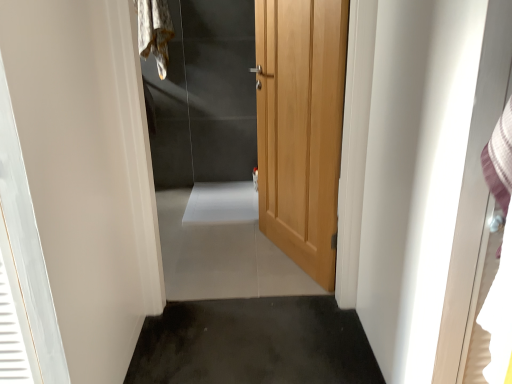
Locate an element on the screen. The height and width of the screenshot is (384, 512). free space on the front side of wooden door at center is located at coordinates (256, 355).